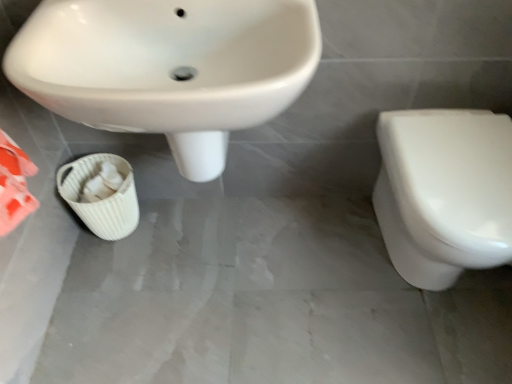
The image size is (512, 384). I want to click on free location in front of white woven basket at lower left, so click(x=112, y=273).